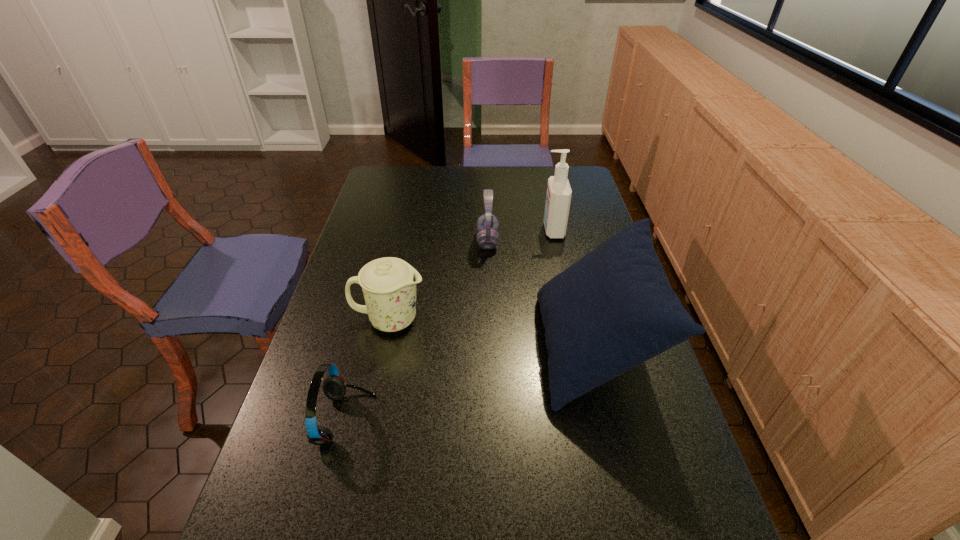
At what (x,y) coordinates should I click in order to perform the action: click on the fourth closest object to the third object from left to right. Please return your answer as a coordinate pair (x, y). Image resolution: width=960 pixels, height=540 pixels. Looking at the image, I should click on (334, 387).

Locate which object ranks third in proximity to the cleansing agent. Please provide its 2D coordinates. Your answer should be formatted as a tuple, i.e. [(x, y)], where the tuple contains the x and y coordinates of a point satisfying the conditions above.

[(389, 284)]